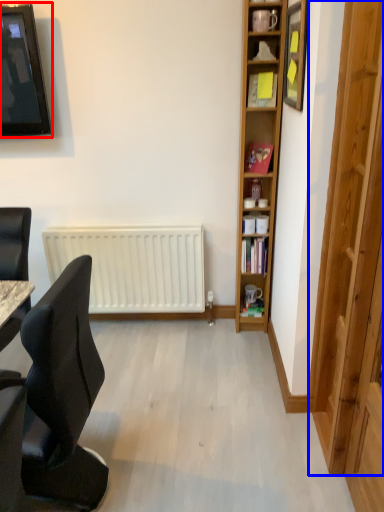
Question: Which object is closer to the camera taking this photo, television (highlighted by a red box) or glass door (highlighted by a blue box)?

Choices:
 (A) television
 (B) glass door

Answer: (B)